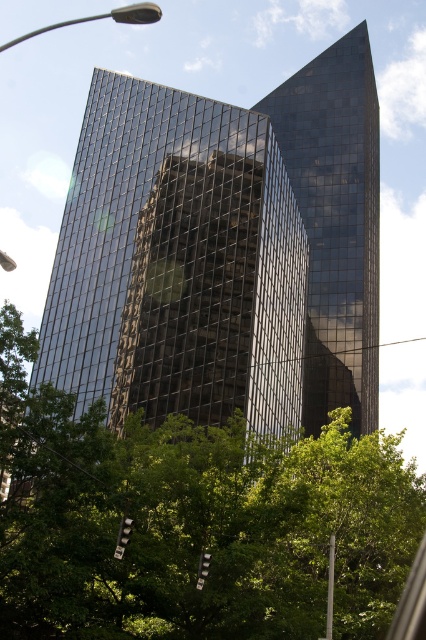
Is point (109, 180) more distant than point (354, 323)?

No, it is in front of (354, 323).

Does shiny glass building at center appear under glossy glass building at center?

Correct, shiny glass building at center is located below glossy glass building at center.

Measure the distance between point [290,378] and camera.

Point [290,378] is 77.38 meters away from camera.

This screenshot has width=426, height=640. Identify the location of shiny glass building at center. (222, 252).

Does shiny glass building at center have a lesser height compared to green leafy tree at lower center?

In fact, shiny glass building at center may be taller than green leafy tree at lower center.

Does shiny glass building at center have a smaller size compared to green leafy tree at lower center?

Incorrect, shiny glass building at center is not smaller in size than green leafy tree at lower center.

The width and height of the screenshot is (426, 640). Identify the location of shiny glass building at center. (222, 252).

How far apart are green leafy tree at lower center and glossy glass building at center?

55.11 meters

Can you confirm if green leafy tree at lower center is shorter than glossy glass building at center?

Yes.

Identify the location of green leafy tree at lower center. (192, 522).